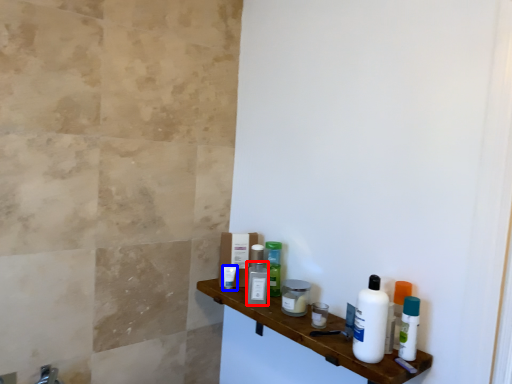
Question: Which point is further to the camera, mouthwash (highlighted by a red box) or toiletry (highlighted by a blue box)?

Choices:
 (A) mouthwash
 (B) toiletry

Answer: (B)